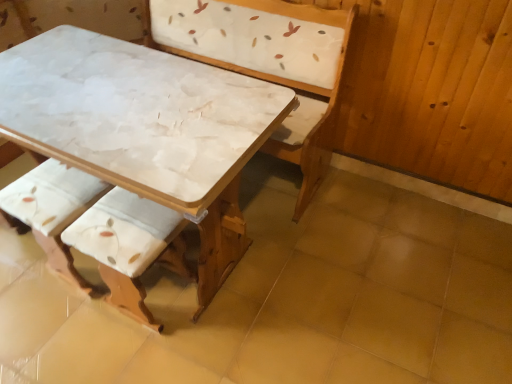
Question: Would you say white marble table at center is a long distance from white marble table at center?

Choices:
 (A) no
 (B) yes

Answer: (A)

Question: Does white marble table at center have a greater width compared to white marble table at center?

Choices:
 (A) yes
 (B) no

Answer: (A)

Question: Can you confirm if white marble table at center is positioned to the right of white marble table at center?

Choices:
 (A) yes
 (B) no

Answer: (A)

Question: Is white marble table at center aimed at white marble table at center?

Choices:
 (A) no
 (B) yes

Answer: (A)

Question: From a real-world perspective, is white marble table at center under white marble table at center?

Choices:
 (A) no
 (B) yes

Answer: (B)

Question: From the image's perspective, is white fabric cushion at lower left, which is the 2th armchair from right to left, located above or below white marble table at center?

Choices:
 (A) below
 (B) above

Answer: (A)

Question: In terms of height, does white fabric cushion at lower left, arranged as the 1th armchair when viewed from the left, look taller or shorter compared to white marble table at center?

Choices:
 (A) short
 (B) tall

Answer: (A)

Question: From a real-world perspective, relative to white marble table at center, is white fabric cushion at lower left, arranged as the 1th armchair when viewed from the left, vertically above or below?

Choices:
 (A) above
 (B) below

Answer: (B)

Question: Is white fabric cushion at lower left, arranged as the 1th armchair when viewed from the left, situated inside white marble table at center or outside?

Choices:
 (A) outside
 (B) inside

Answer: (B)

Question: Considering the positions of white fabric cushion at lower left, which is the 2th armchair from right to left, and white fabric cushion at lower left, the 1th armchair from the right, in the image, is white fabric cushion at lower left, which is the 2th armchair from right to left, wider or thinner than white fabric cushion at lower left, the 1th armchair from the right,?

Choices:
 (A) wide
 (B) thin

Answer: (B)

Question: From a real-world perspective, is white fabric cushion at lower left, which is the 2th armchair from right to left, positioned above or below white fabric cushion at lower left, the 2th armchair positioned from the left?

Choices:
 (A) below
 (B) above

Answer: (A)

Question: Would you say white fabric cushion at lower left, which is the 2th armchair from right to left, is inside or outside white fabric cushion at lower left, the 1th armchair from the right?

Choices:
 (A) inside
 (B) outside

Answer: (B)

Question: From the image's perspective, is white fabric cushion at lower left, which is the 2th armchair from right to left, above or below white fabric cushion at lower left, the 1th armchair from the right?

Choices:
 (A) below
 (B) above

Answer: (B)

Question: Is white fabric cushion at lower left, the 1th armchair from the right, bigger or smaller than white fabric cushion at lower left, which is the 2th armchair from right to left?

Choices:
 (A) small
 (B) big

Answer: (B)

Question: Considering their positions, is white fabric cushion at lower left, the 1th armchair from the right, located in front of or behind white fabric cushion at lower left, arranged as the 1th armchair when viewed from the left?

Choices:
 (A) behind
 (B) front

Answer: (B)